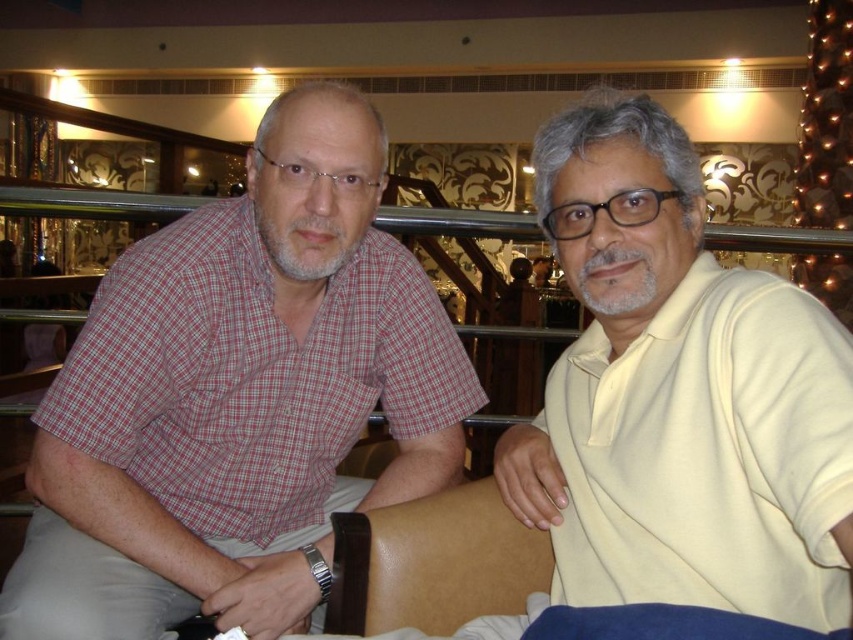
You are trying to take a photo of the red checkered shirt at left and the brown leather chair at center. Which object should you focus on first to ensure it appears sharp in the photo?

You should focus on the red checkered shirt at left first because it is closer to the viewer than the brown leather chair at center, so focusing on the closer object ensures it will be sharp.

You are a delivery robot that is 25 centimeters wide. You are in a room and need to move from your current position to the door on the opposite side. There is a yellow matte shirt at right and a brown leather chair at center in the way. Can you pass between them without touching either?

The distance between the yellow matte shirt at right and the brown leather chair at center is 30.30 centimeters. Since the robot is 25 centimeters wide, it can fit through the gap as 30.30 cm is wider than 25 cm.

You are standing in a room where two people are sitting. You can see the red checkered shirt at left and the yellow matte shirt at right. Which shirt is closer to the left side of the room?

The red checkered shirt at left is closer to the left side of the room because it is positioned to the left of the yellow matte shirt at right.